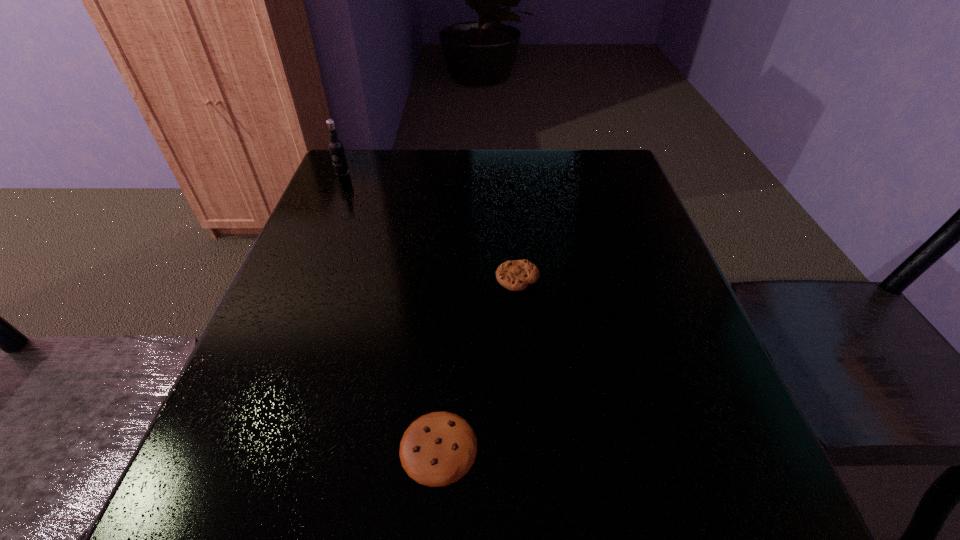
This screenshot has width=960, height=540. What are the coordinates of `object that is at the near edge` in the screenshot? It's located at (439, 448).

Where is `object situated at the left edge`? object situated at the left edge is located at coordinates pyautogui.click(x=336, y=149).

The height and width of the screenshot is (540, 960). Identify the location of object that is at the far left corner. (336, 149).

In the image, there is a desktop. Identify the location of vacant region at the far edge. (532, 174).

The height and width of the screenshot is (540, 960). In order to click on free space at the near edge of the desktop in this screenshot , I will do `click(307, 534)`.

The height and width of the screenshot is (540, 960). In order to click on free space at the left edge in this screenshot , I will do `click(300, 436)`.

Identify the location of free point at the right edge. The image size is (960, 540). (652, 256).

You are a GUI agent. You are given a task and a screenshot of the screen. Output one action in this format:
    pyautogui.click(x=<x>, y=<y>)
    Task: Click on the free space at the far left corner of the desktop
    This screenshot has width=960, height=540.
    Given the screenshot: What is the action you would take?
    pyautogui.click(x=392, y=155)

Identify the location of vacant space at the far right corner. (610, 148).

Where is `empty space that is in between the leftmost object and the left cookie`? The width and height of the screenshot is (960, 540). empty space that is in between the leftmost object and the left cookie is located at coordinates (391, 310).